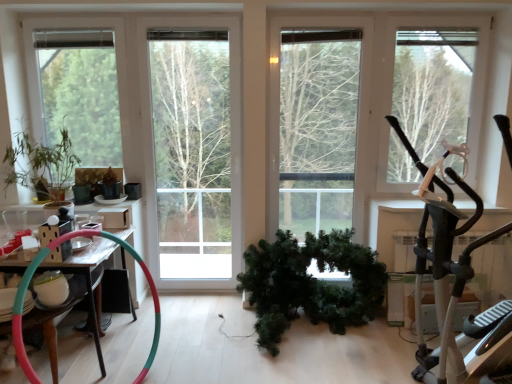
Question: From a real-world perspective, is green matte wreath at center, the 1th houseplant in the right-to-left sequence, under green matte tree at center, which is the 2th tree from right to left?

Choices:
 (A) yes
 (B) no

Answer: (A)

Question: Could you tell me if green matte wreath at center, which appears as the 1th houseplant when ordered from the bottom, is turned towards green matte tree at center, which is the 2th tree from right to left?

Choices:
 (A) no
 (B) yes

Answer: (A)

Question: Is green matte wreath at center, which is counted as the 2th houseplant, starting from the left, looking in the opposite direction of green matte tree at center, which is the 2th tree from right to left?

Choices:
 (A) no
 (B) yes

Answer: (A)

Question: Is green matte wreath at center, which appears as the 1th houseplant when ordered from the bottom, located outside green matte tree at center, the 2th tree in the left-to-right sequence?

Choices:
 (A) no
 (B) yes

Answer: (B)

Question: Is green matte wreath at center, positioned as the 2th houseplant in top-to-bottom order, not close to green matte tree at center, which is the 2th tree from right to left?

Choices:
 (A) yes
 (B) no

Answer: (A)

Question: From a real-world perspective, is green matte wreath at center, the 1th houseplant in the right-to-left sequence, located higher than green matte tree at center, which is the 2th tree from right to left?

Choices:
 (A) yes
 (B) no

Answer: (B)

Question: Considering the relative positions of wooden table at left and green matte tree at right, which is the first tree from right to left, in the image provided, is wooden table at left to the right of green matte tree at right, which is the first tree from right to left, from the viewer's perspective?

Choices:
 (A) no
 (B) yes

Answer: (A)

Question: Considering the relative sizes of wooden table at left and green matte tree at right, positioned as the third tree in left-to-right order, in the image provided, is wooden table at left wider than green matte tree at right, positioned as the third tree in left-to-right order,?

Choices:
 (A) no
 (B) yes

Answer: (B)

Question: From a real-world perspective, is wooden table at left positioned over green matte tree at right, which is the first tree from right to left, based on gravity?

Choices:
 (A) yes
 (B) no

Answer: (B)

Question: Can you confirm if wooden table at left is smaller than green matte tree at right, which is the first tree from right to left?

Choices:
 (A) no
 (B) yes

Answer: (A)

Question: Is wooden table at left positioned behind green matte tree at right, which is the first tree from right to left?

Choices:
 (A) no
 (B) yes

Answer: (A)

Question: Is wooden table at left shorter than green matte tree at right, positioned as the third tree in left-to-right order?

Choices:
 (A) no
 (B) yes

Answer: (B)

Question: Considering the relative positions of green matte plant at left, the second houseplant ordered from the bottom, and green matte tree at center, the 2th tree in the left-to-right sequence, in the image provided, is green matte plant at left, the second houseplant ordered from the bottom, behind green matte tree at center, the 2th tree in the left-to-right sequence,?

Choices:
 (A) yes
 (B) no

Answer: (B)